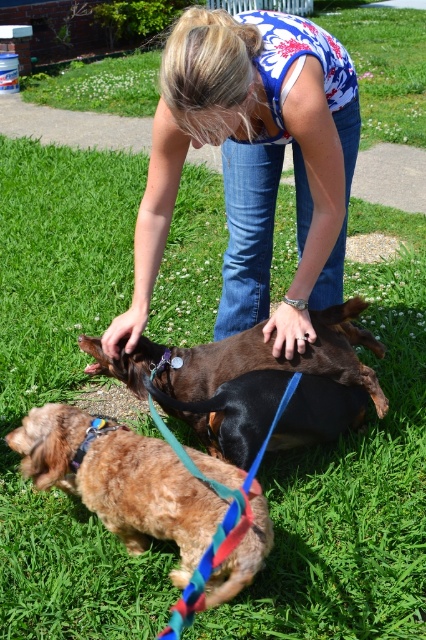
Question: Can you confirm if brown glossy dog at center is positioned above shiny brown fur at lower left?

Choices:
 (A) no
 (B) yes

Answer: (B)

Question: Considering the real-world distances, which object is closest to the blue floral tank top at center?

Choices:
 (A) shiny brown fur at lower left
 (B) brown glossy dog at center

Answer: (B)

Question: Among these objects, which one is nearest to the camera?

Choices:
 (A) blue floral tank top at center
 (B) shiny brown fur at lower left

Answer: (A)

Question: Is brown glossy dog at center wider than shiny brown fur at lower left?

Choices:
 (A) yes
 (B) no

Answer: (A)

Question: Is blue floral tank top at center wider than shiny brown fur at lower left?

Choices:
 (A) yes
 (B) no

Answer: (A)

Question: Which object is farther from the camera taking this photo?

Choices:
 (A) shiny brown fur at lower left
 (B) blue floral tank top at center

Answer: (A)